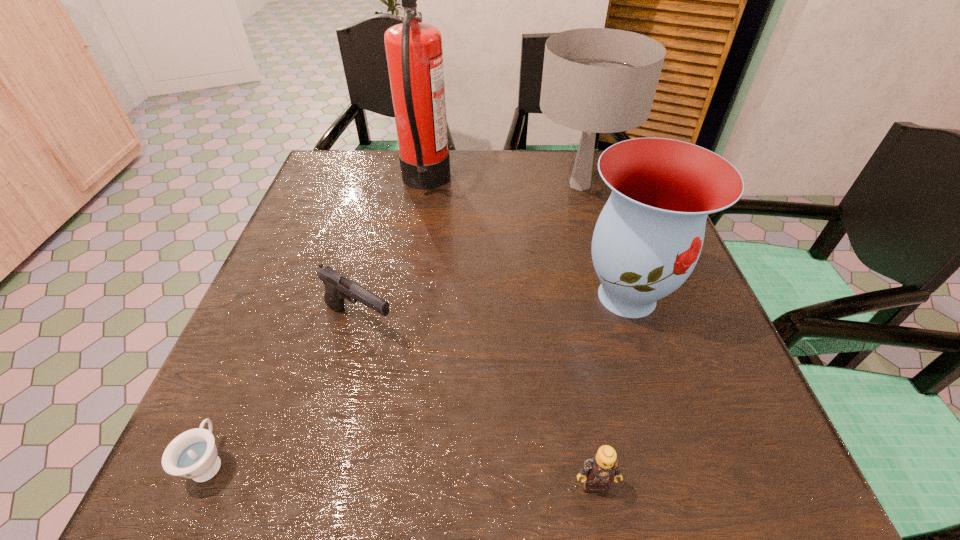
At what (x,y) coordinates should I click in order to perform the action: click on lampshade located in the right edge section of the desktop. Please return your answer as a coordinate pair (x, y). The image size is (960, 540). Looking at the image, I should click on (596, 80).

This screenshot has height=540, width=960. Find the location of `vase that is at the right edge`. vase that is at the right edge is located at coordinates (648, 238).

Locate an element on the screen. The width and height of the screenshot is (960, 540). object that is at the near left corner is located at coordinates (193, 454).

Find the location of a particular element. Image resolution: width=960 pixels, height=540 pixels. object that is at the far right corner is located at coordinates (596, 80).

In the image, there is a desktop. Identify the location of free space at the far edge. (383, 197).

The image size is (960, 540). What are the coordinates of `free location at the near edge of the desktop` in the screenshot? It's located at (400, 460).

The width and height of the screenshot is (960, 540). Identify the location of vacant space at the left edge of the desktop. (310, 208).

Identify the location of vacant space at the right edge. The height and width of the screenshot is (540, 960). (708, 431).

Image resolution: width=960 pixels, height=540 pixels. Identify the location of vacant space at the far left corner of the desktop. coord(372,173).

Locate an element on the screen. vacant space at the near right corner is located at coordinates (677, 454).